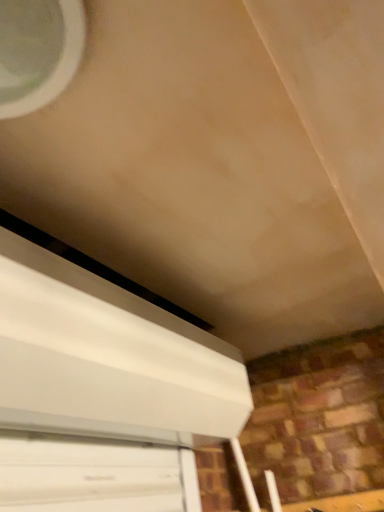
Describe the element at coordinates (38, 51) in the screenshot. Image resolution: width=384 pixels, height=512 pixels. I see `white glossy window at upper left` at that location.

Image resolution: width=384 pixels, height=512 pixels. I want to click on white glossy window at upper left, so click(x=38, y=51).

Locate an element on the screen. The image size is (384, 512). white glossy window at upper left is located at coordinates (38, 51).